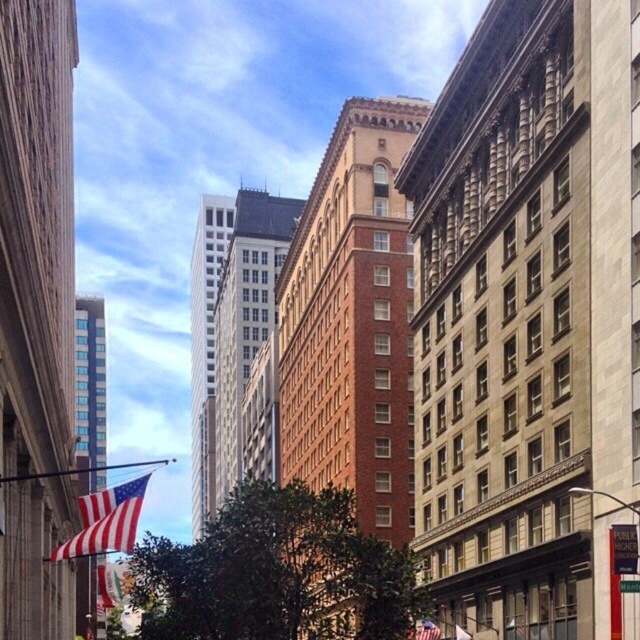
Question: Among these objects, which one is nearest to the camera?

Choices:
 (A) red fabric flag at left
 (B) red-white striped fabric flag at lower left

Answer: (B)

Question: Which point is farther to the camera?

Choices:
 (A) red-white striped fabric flag at lower left
 (B) red fabric flag at left

Answer: (B)

Question: Is the position of red-white striped fabric flag at lower left less distant than that of red fabric flag at left?

Choices:
 (A) yes
 (B) no

Answer: (A)

Question: Can you confirm if red-white striped fabric flag at lower left is positioned to the right of red fabric flag at left?

Choices:
 (A) no
 (B) yes

Answer: (A)

Question: Is the position of red-white striped fabric flag at lower left less distant than that of red fabric flag at left?

Choices:
 (A) no
 (B) yes

Answer: (B)